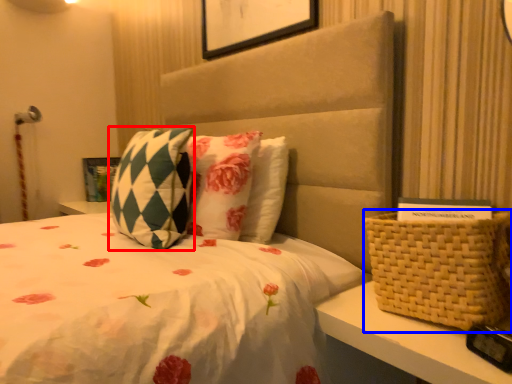
Question: Which object appears farthest to the camera in this image, pillow (highlighted by a red box) or basket (highlighted by a blue box)?

Choices:
 (A) pillow
 (B) basket

Answer: (A)